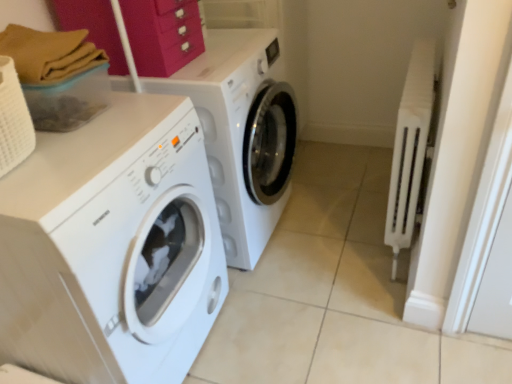
Question: From the image's perspective, is white glossy washing machine at center, the 1th washing machine positioned from the back, located above matte pink drawer at upper center?

Choices:
 (A) no
 (B) yes

Answer: (A)

Question: Is white glossy washing machine at center, the 1th washing machine positioned from the back, at the left side of matte pink drawer at upper center?

Choices:
 (A) yes
 (B) no

Answer: (B)

Question: Is white glossy washing machine at center, positioned as the second washing machine in front-to-back order, bigger than matte pink drawer at upper center?

Choices:
 (A) yes
 (B) no

Answer: (A)

Question: Is matte pink drawer at upper center surrounded by white glossy washing machine at center, positioned as the second washing machine in front-to-back order?

Choices:
 (A) no
 (B) yes

Answer: (A)

Question: From a real-world perspective, is white glossy washing machine at center, positioned as the second washing machine in front-to-back order, positioned over matte pink drawer at upper center based on gravity?

Choices:
 (A) yes
 (B) no

Answer: (B)

Question: From a real-world perspective, is white plastic radiator at right above or below white glossy washing machine at center, positioned as the second washing machine in front-to-back order?

Choices:
 (A) below
 (B) above

Answer: (A)

Question: In terms of height, does white plastic radiator at right look taller or shorter compared to white glossy washing machine at center, positioned as the second washing machine in front-to-back order?

Choices:
 (A) short
 (B) tall

Answer: (A)

Question: Is white plastic radiator at right wider or thinner than white glossy washing machine at center, positioned as the second washing machine in front-to-back order?

Choices:
 (A) thin
 (B) wide

Answer: (A)

Question: Considering their positions, is white plastic radiator at right located in front of or behind white glossy washing machine at center, positioned as the second washing machine in front-to-back order?

Choices:
 (A) behind
 (B) front

Answer: (B)

Question: Based on their sizes in the image, would you say matte pink drawer at upper center is bigger or smaller than white glossy washing machine at center, the 1th washing machine positioned from the back?

Choices:
 (A) small
 (B) big

Answer: (A)

Question: Does point (124, 11) appear closer or farther from the camera than point (244, 177)?

Choices:
 (A) farther
 (B) closer

Answer: (B)

Question: From a real-world perspective, is matte pink drawer at upper center above or below white glossy washing machine at center, the 1th washing machine positioned from the back?

Choices:
 (A) below
 (B) above

Answer: (B)

Question: From the image's perspective, is matte pink drawer at upper center located above or below white glossy washing machine at center, positioned as the second washing machine in front-to-back order?

Choices:
 (A) above
 (B) below

Answer: (A)

Question: Considering the positions of point (392, 185) and point (138, 19), is point (392, 185) closer or farther from the camera than point (138, 19)?

Choices:
 (A) closer
 (B) farther

Answer: (B)

Question: Is white plastic radiator at right inside or outside of matte pink drawer at upper center?

Choices:
 (A) outside
 (B) inside

Answer: (A)